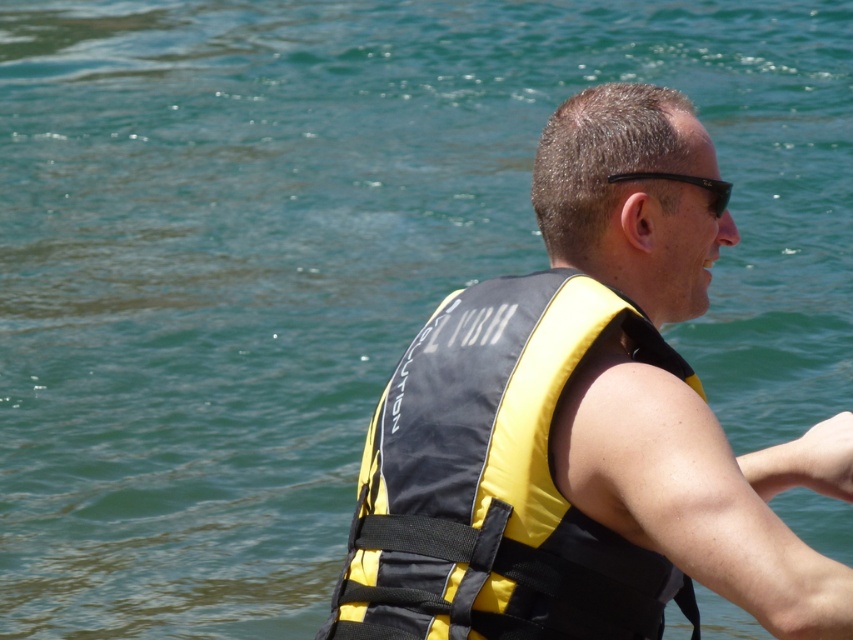
Question: Can you confirm if yellow/black life vest at center is positioned above black matte sunglasses at upper center?

Choices:
 (A) yes
 (B) no

Answer: (B)

Question: Which object is farther from the camera taking this photo?

Choices:
 (A) yellow fabric life jacket at center
 (B) black matte sunglasses at upper center

Answer: (B)

Question: Does yellow/black life vest at center have a lesser width compared to yellow fabric life jacket at center?

Choices:
 (A) yes
 (B) no

Answer: (B)

Question: From the image, what is the correct spatial relationship of yellow/black life vest at center in relation to black matte sunglasses at upper center?

Choices:
 (A) above
 (B) below

Answer: (B)

Question: Which object is the closest to the black matte sunglasses at upper center?

Choices:
 (A) yellow/black life vest at center
 (B) yellow fabric life jacket at center

Answer: (A)

Question: Which point is closer to the camera?

Choices:
 (A) black matte sunglasses at upper center
 (B) yellow fabric life jacket at center

Answer: (B)